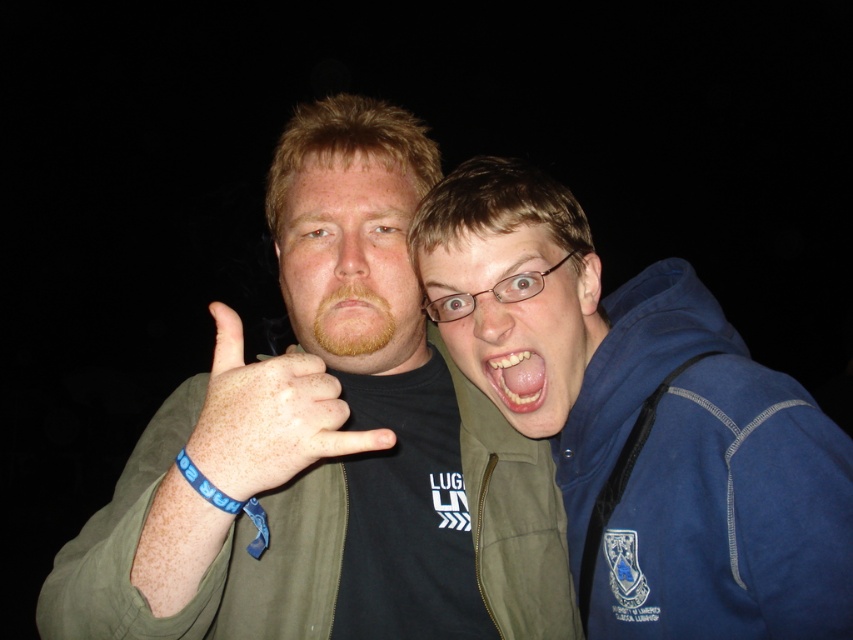
Looking at this image, you are a photographer trying to capture a closeup shot of the two people in the image. Since you want to focus on their facial features, which object between the light brown hair at center and the matte green face at center should you prioritize framing in your shot due to its size?

The matte green face at center has a greater width than the light brown hair at center, so you should prioritize framing the matte green face at center in your shot because it is larger and more prominent.

You are a photographer trying to capture a group photo of the blue fleece jacket at right and the matte green face at center. Based on their sizes, which object should you position closer to the camera to ensure both appear balanced in the final image?

The blue fleece jacket at right is larger than the matte green face at center, so you should position the blue fleece jacket at right farther from the camera and the matte green face at center closer to the camera to balance their sizes in the photo.